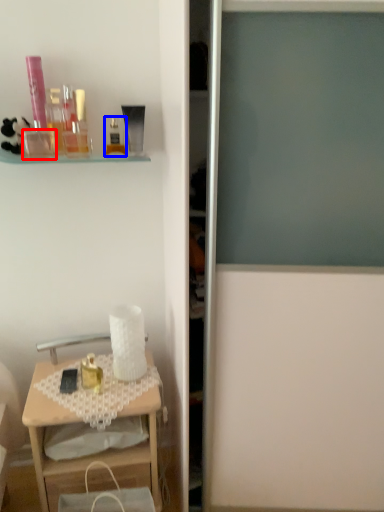
Question: Which of the following is the closest to the observer, toiletry (highlighted by a red box) or toiletry (highlighted by a blue box)?

Choices:
 (A) toiletry
 (B) toiletry

Answer: (A)